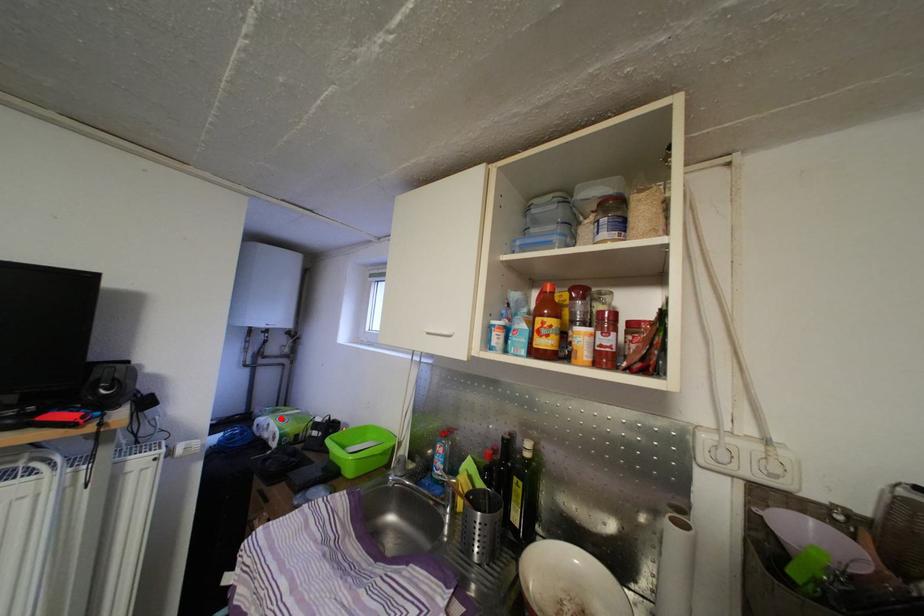
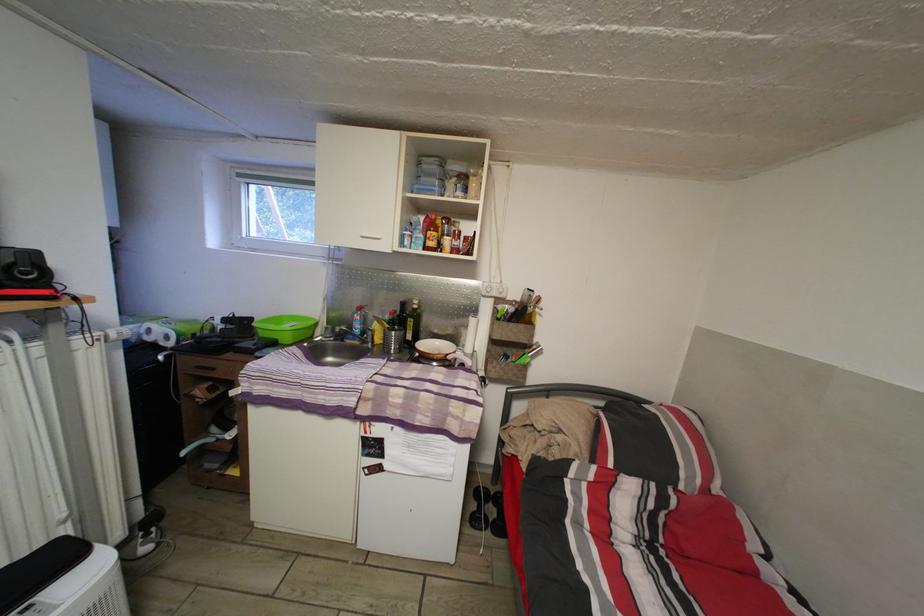
The point at the highlighted location is marked in the first image. Where is the corresponding point in the second image?

(144, 328)